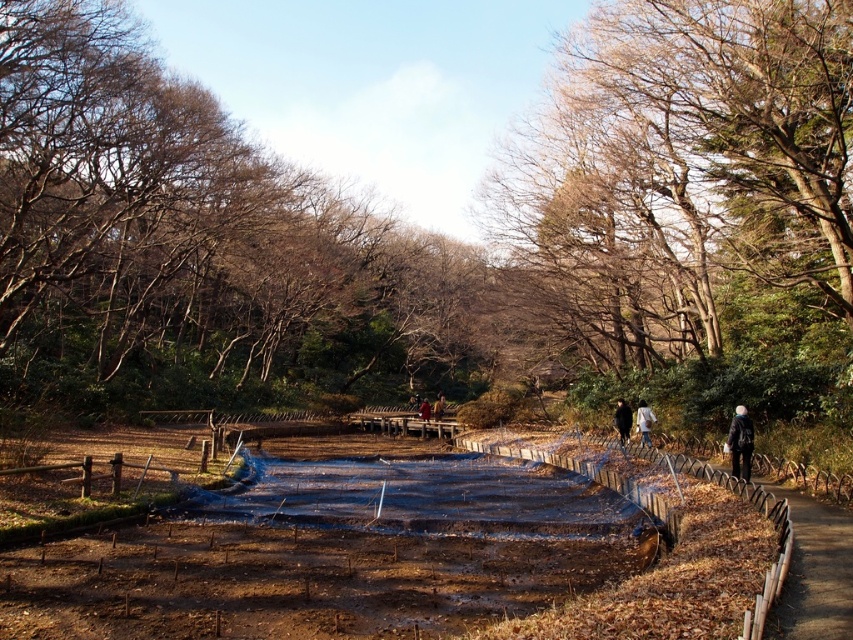
You are standing in the park and see two points marked in the scene. Which point is closer to you, point (238, 180) or point (619, 429)?

Point (619, 429) is closer to you because it is less further to the camera than point (238, 180).